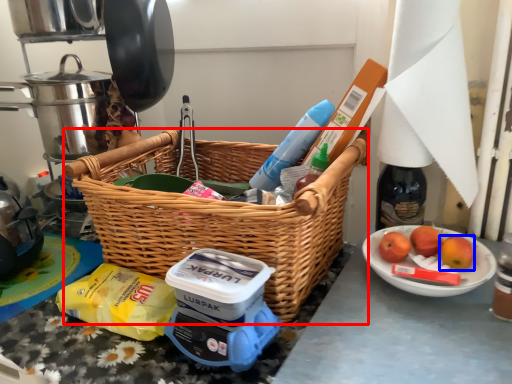
Question: Which object is closer to the camera taking this photo, picnic basket (highlighted by a red box) or apple (highlighted by a blue box)?

Choices:
 (A) picnic basket
 (B) apple

Answer: (A)